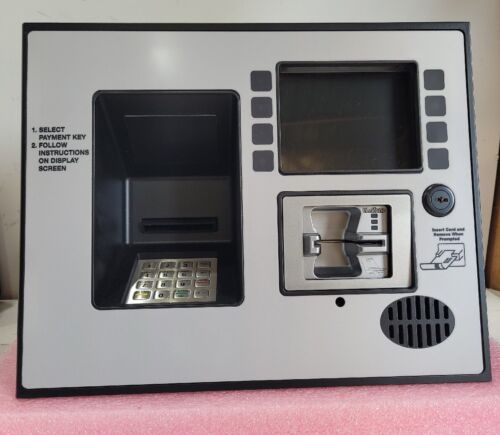
Identify the location of keypad. (179, 277).